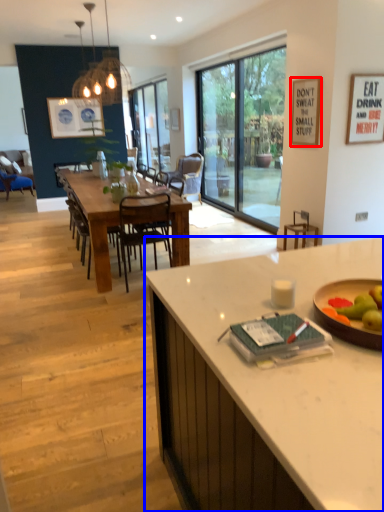
Question: Which point is further to the camera, picture frame (highlighted by a red box) or desk (highlighted by a blue box)?

Choices:
 (A) picture frame
 (B) desk

Answer: (A)